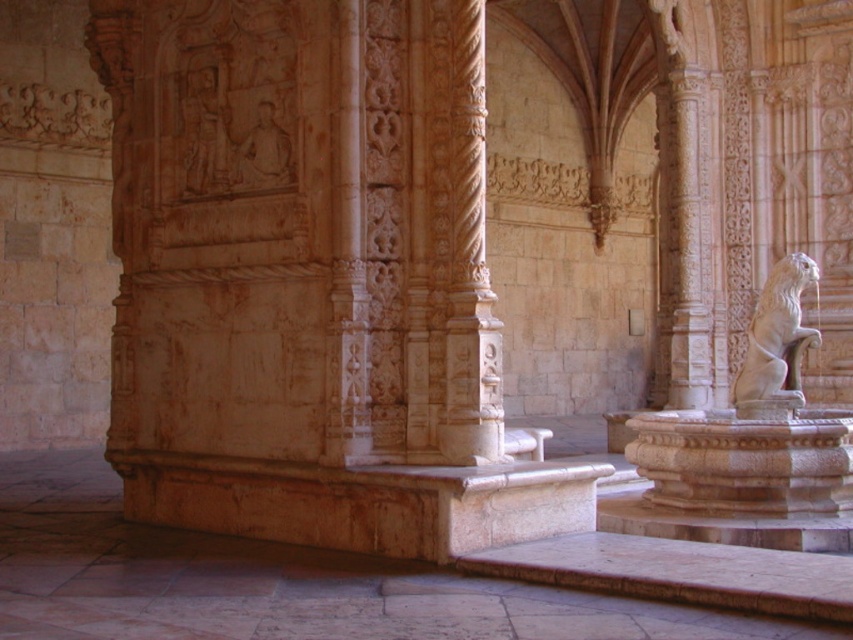
You are standing in the center of the historical building and notice a point marked at coordinates (x=469, y=260). What object is located at that point?

The point at coordinates (x=469, y=260) indicates a white stone column at center.

Based on the photo, you are standing in the historical building and want to move from the point at coordinates point (469, 365) to the point at coordinates point (785, 278). Will you need to walk towards the back of the building or towards the entrance?

You will need to walk towards the back of the building because point (469, 365) is in front of point (785, 278), meaning point (785, 278) is located further back in the building.

You are an architect examining the interior of a historical building. You notice two columns in the center of the room. One is labeled as the white stone column at center and the other as the carved stone column at center. Which of these two columns is bigger in size?

The white stone column at center has a larger size compared to the carved stone column at center.